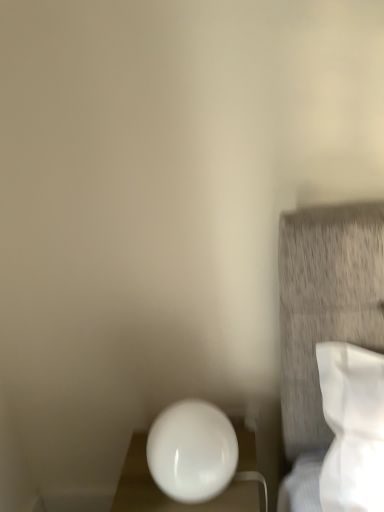
What are the coordinates of `white glossy sphere at lower left` in the screenshot? It's located at (192, 451).

Measure the distance between point (168, 433) and camera.

A distance of 3.57 feet exists between point (168, 433) and camera.

What is the approximate width of white glossy sphere at lower left?

The width of white glossy sphere at lower left is 9.23 inches.

Describe the element at coordinates (192, 451) in the screenshot. Image resolution: width=384 pixels, height=512 pixels. I see `white glossy sphere at lower left` at that location.

Where is `white glossy sphere at lower center`? white glossy sphere at lower center is located at coordinates pyautogui.click(x=184, y=503).

What do you see at coordinates (184, 503) in the screenshot? I see `white glossy sphere at lower center` at bounding box center [184, 503].

Measure the distance between white glossy sphere at lower center and camera.

A distance of 3.54 feet exists between white glossy sphere at lower center and camera.

Locate an element on the screen. This screenshot has height=512, width=384. white glossy sphere at lower left is located at coordinates (192, 451).

Between white glossy sphere at lower left and white glossy sphere at lower center, which one appears on the right side from the viewer's perspective?

white glossy sphere at lower center.

From the picture: Which object is more forward, white glossy sphere at lower left or white glossy sphere at lower center?

white glossy sphere at lower left is more forward.

Does point (189, 419) come closer to viewer compared to point (245, 471)?

Yes, it is in front of point (245, 471).

From the image's perspective, which one is positioned higher, white glossy sphere at lower left or white glossy sphere at lower center?

From the image's view, white glossy sphere at lower left is above.

From a real-world perspective, relative to white glossy sphere at lower center, is white glossy sphere at lower left vertically above or below?

From a real-world perspective, white glossy sphere at lower left is physically above white glossy sphere at lower center.

Which object is wider, white glossy sphere at lower left or white glossy sphere at lower center?

With larger width is white glossy sphere at lower center.

Which of these two, white glossy sphere at lower left or white glossy sphere at lower center, stands taller?

With more height is white glossy sphere at lower center.

Based on the photo, can you confirm if white glossy sphere at lower left is smaller than white glossy sphere at lower center?

Correct, white glossy sphere at lower left occupies less space than white glossy sphere at lower center.

Would you say white glossy sphere at lower left is outside white glossy sphere at lower center?

Yes, white glossy sphere at lower left is located beyond the bounds of white glossy sphere at lower center.

Is white glossy sphere at lower left in contact with white glossy sphere at lower center?

white glossy sphere at lower left is not next to white glossy sphere at lower center, and they're not touching.

Is white glossy sphere at lower left looking in the opposite direction of white glossy sphere at lower center?

No, white glossy sphere at lower center is not at the back of white glossy sphere at lower left.

Can you tell me how much white glossy sphere at lower left and white glossy sphere at lower center differ in facing direction?

They differ by 1.2 degrees in their facing directions.

Where is `oval on the left of the white glossy sphere at lower center`? oval on the left of the white glossy sphere at lower center is located at coordinates (192, 451).

Between white glossy sphere at lower center and white glossy sphere at lower left, which one appears on the right side from the viewer's perspective?

From the viewer's perspective, white glossy sphere at lower center appears more on the right side.

Which object is closer to the camera taking this photo, white glossy sphere at lower center or white glossy sphere at lower left?

white glossy sphere at lower left is closer to the camera.

Which is behind, point (128, 475) or point (213, 471)?

The point (128, 475) is behind.

From the image's perspective, would you say white glossy sphere at lower center is shown under white glossy sphere at lower left?

Indeed, from the image's perspective, white glossy sphere at lower center is shown beneath white glossy sphere at lower left.

From a real-world perspective, is white glossy sphere at lower center on white glossy sphere at lower left?

Actually, white glossy sphere at lower center is physically below white glossy sphere at lower left in the real world.

Between white glossy sphere at lower center and white glossy sphere at lower left, which one has larger width?

Wider between the two is white glossy sphere at lower center.

Can you confirm if white glossy sphere at lower center is shorter than white glossy sphere at lower left?

Incorrect, the height of white glossy sphere at lower center does not fall short of that of white glossy sphere at lower left.

Looking at the image, does white glossy sphere at lower center seem bigger or smaller compared to white glossy sphere at lower left?

white glossy sphere at lower center is bigger than white glossy sphere at lower left.

Is white glossy sphere at lower center located outside white glossy sphere at lower left?

white glossy sphere at lower center is positioned outside white glossy sphere at lower left.

Are white glossy sphere at lower center and white glossy sphere at lower left beside each other?

No.

Is white glossy sphere at lower center positioned with its back to white glossy sphere at lower left?

white glossy sphere at lower center does not have its back to white glossy sphere at lower left.

Looking at this image, what's the angular difference between white glossy sphere at lower center and white glossy sphere at lower left's facing directions?

The facing directions of white glossy sphere at lower center and white glossy sphere at lower left are 1.2 degrees apart.

Where is `furniture below the white glossy sphere at lower left (from the image's perspective)`? The height and width of the screenshot is (512, 384). furniture below the white glossy sphere at lower left (from the image's perspective) is located at coordinates (184, 503).

Identify the location of oval positioned vertically above the white glossy sphere at lower center (from a real-world perspective). The image size is (384, 512). (192, 451).

Find the location of `oval located in front of the white glossy sphere at lower center`. oval located in front of the white glossy sphere at lower center is located at coordinates (192, 451).